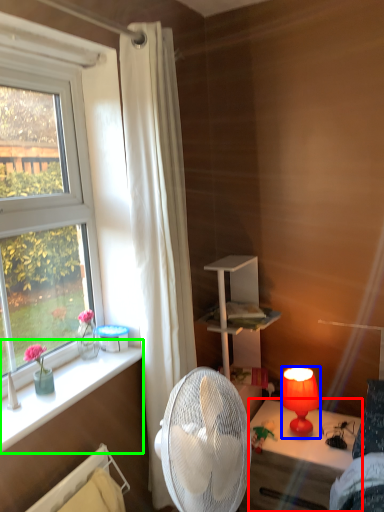
Question: Estimate the real-world distances between objects in this image. Which object is closer to desk (highlighted by a red box), lamp (highlighted by a blue box) or window sill (highlighted by a green box)?

Choices:
 (A) lamp
 (B) window sill

Answer: (A)